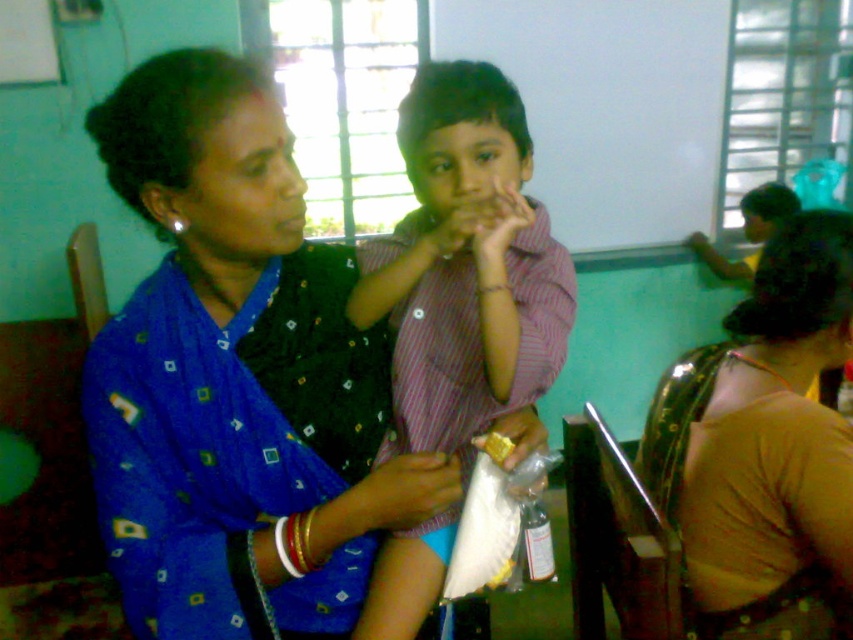
Between striped cotton shirt at center and brown fabric sari at lower right, which one has less height?

Standing shorter between the two is brown fabric sari at lower right.

Does striped cotton shirt at center have a lesser width compared to brown fabric sari at lower right?

Yes.

Is point (450, 246) positioned behind point (843, 572)?

That is False.

Identify the location of striped cotton shirt at center. The height and width of the screenshot is (640, 853). (466, 264).

Looking at this image, which of these two, blue printed sari at center or yellow matte snack at center, stands taller?

Standing taller between the two is blue printed sari at center.

Is point (258, 216) more distant than point (483, 448)?

No.

Locate an element on the screen. This screenshot has width=853, height=640. blue printed sari at center is located at coordinates (236, 376).

In the scene shown: Is blue printed sari at center taller than striped cotton shirt at center?

In fact, blue printed sari at center may be shorter than striped cotton shirt at center.

Is point (218, 506) more distant than point (428, 227)?

No, it is not.

Is point (131, 129) closer to camera compared to point (474, 182)?

Yes, it is.

You are a GUI agent. You are given a task and a screenshot of the screen. Output one action in this format:
    pyautogui.click(x=<x>, y=<y>)
    Task: Click on the blue printed sari at center
    
    Given the screenshot: What is the action you would take?
    pyautogui.click(x=236, y=376)